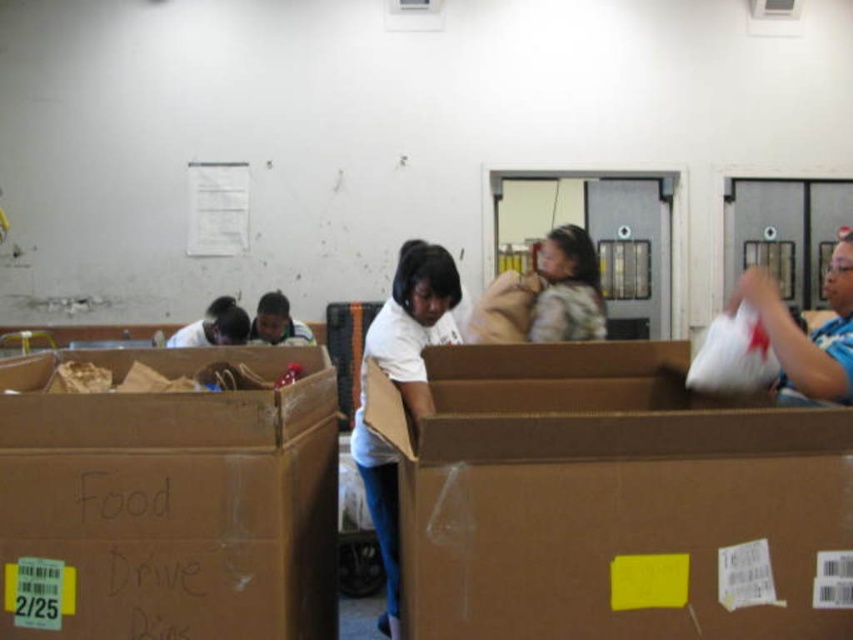
Between matte white shirt at center and smooth black shirt at center, which one appears on the right side from the viewer's perspective?

From the viewer's perspective, smooth black shirt at center appears more on the right side.

Does point (219, 321) lie behind point (265, 294)?

No, it is not.

At what (x,y) coordinates should I click in order to perform the action: click on matte white shirt at center. Please return your answer as a coordinate pair (x, y). This screenshot has height=640, width=853. Looking at the image, I should click on (213, 326).

Locate an element on the screen. This screenshot has width=853, height=640. matte white shirt at center is located at coordinates (213, 326).

Based on the photo, who is more distant from viewer, (x=525, y=600) or (x=393, y=456)?

The point (x=393, y=456) is more distant.

Does brown cardboard box at center have a greater width compared to white matte shirt at center?

Yes, brown cardboard box at center is wider than white matte shirt at center.

At what (x,y) coordinates should I click in order to perform the action: click on brown cardboard box at center. Please return your answer as a coordinate pair (x, y). Looking at the image, I should click on (614, 500).

Based on the photo, who is positioned more to the right, white matte shirt at center or smooth black shirt at center?

From the viewer's perspective, white matte shirt at center appears more on the right side.

Does white matte shirt at center appear on the right side of smooth black shirt at center?

Correct, you'll find white matte shirt at center to the right of smooth black shirt at center.

At what (x,y) coordinates should I click in order to perform the action: click on white matte shirt at center. Please return your answer as a coordinate pair (x, y). Looking at the image, I should click on (415, 321).